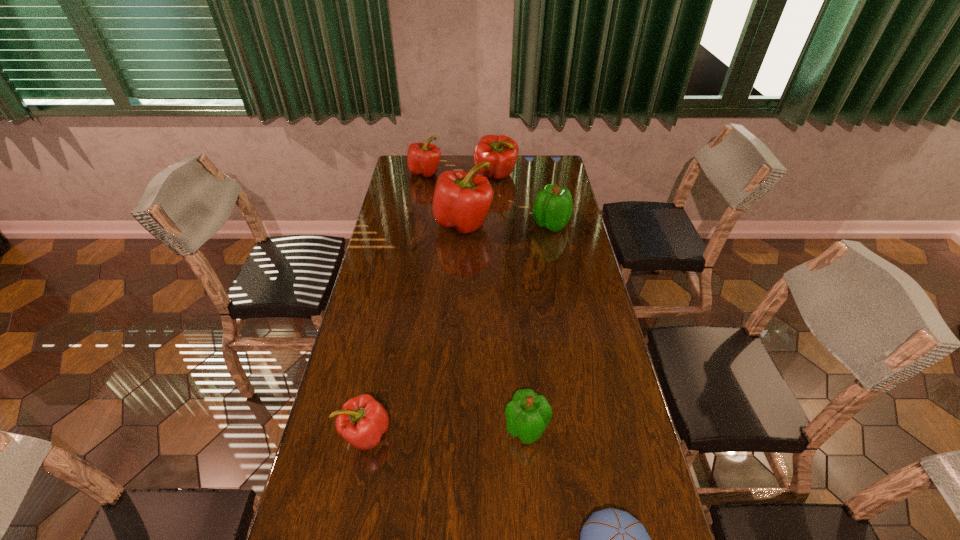
The height and width of the screenshot is (540, 960). I want to click on free spot located 0.100m on the right of the second biggest pink bell pepper, so click(x=539, y=176).

Locate an element on the screen. Image resolution: width=960 pixels, height=540 pixels. vacant space located 0.340m on the back of the bigger green bell pepper is located at coordinates (540, 173).

Where is `vacant space located 0.070m on the back of the third biggest pink bell pepper`? This screenshot has width=960, height=540. vacant space located 0.070m on the back of the third biggest pink bell pepper is located at coordinates (428, 158).

You are a GUI agent. You are given a task and a screenshot of the screen. Output one action in this format:
    pyautogui.click(x=<x>, y=<y>)
    Task: Click on the blank space located 0.110m on the front of the nearer green bell pepper
    The image size is (960, 540).
    Given the screenshot: What is the action you would take?
    pyautogui.click(x=532, y=495)

The width and height of the screenshot is (960, 540). Identify the location of vacant space located 0.220m on the right of the smallest pink bell pepper. (475, 434).

Find the location of `object located at the right edge`. object located at the right edge is located at coordinates (552, 209).

This screenshot has height=540, width=960. What are the coordinates of `object that is positioned at the far left corner` in the screenshot? It's located at (423, 159).

In the image, there is a desktop. Identify the location of vacant space at the left edge. (420, 183).

This screenshot has height=540, width=960. In order to click on free space at the right edge in this screenshot , I will do `click(569, 238)`.

The image size is (960, 540). In order to click on vacant area between the nearer green bell pepper and the third smallest pink bell pepper in this screenshot , I will do `click(512, 302)`.